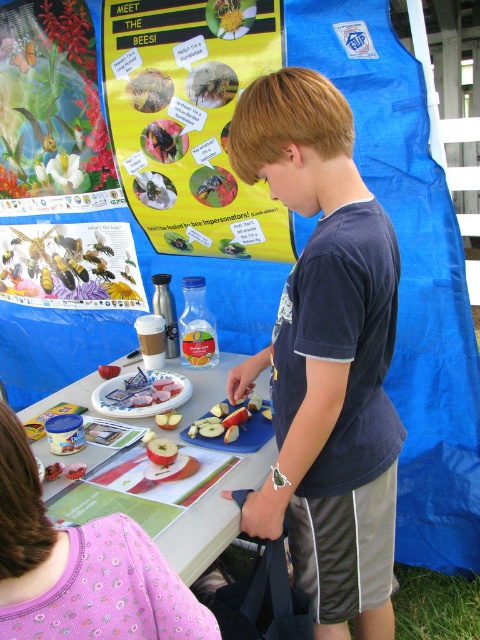
Between point (13, 264) and point (81, 474), which one is positioned in front?

Point (81, 474)

Consider the image. Is matte yellow poster at upper center above smooth red apple at center?

Yes.

Where is `matte yellow poster at upper center`? The image size is (480, 640). matte yellow poster at upper center is located at coordinates (71, 266).

Describe the element at coordinates (325, 356) in the screenshot. I see `dark blue t-shirt at center` at that location.

Does dark blue t-shirt at center have a greater width compared to white plastic table at center?

No, dark blue t-shirt at center is not wider than white plastic table at center.

Who is more forward, (348, 356) or (199, 560)?

Point (348, 356) is more forward.

Where is `dark blue t-shirt at center`? The width and height of the screenshot is (480, 640). dark blue t-shirt at center is located at coordinates (325, 356).

Which is more to the right, dark blue t-shirt at center or metallic poster at upper left?

From the viewer's perspective, dark blue t-shirt at center appears more on the right side.

In the scene shown: Who is positioned more to the left, dark blue t-shirt at center or metallic poster at upper left?

metallic poster at upper left is more to the left.

Who is more distant from viewer, [302,468] or [51,84]?

Positioned behind is point [51,84].

Find the location of `dark blue t-shirt at center`. dark blue t-shirt at center is located at coordinates (325, 356).